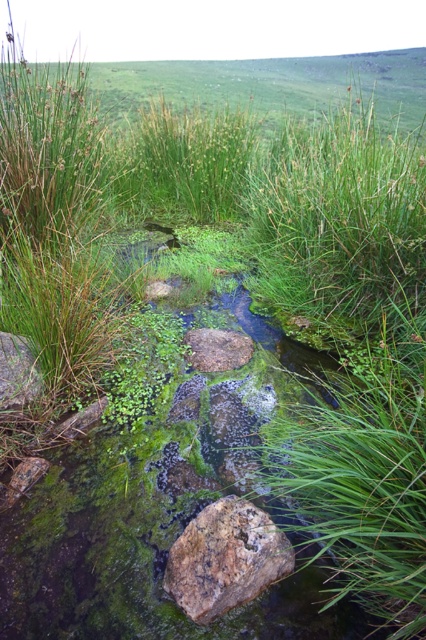
Is brown rough rock at center closer to the viewer compared to brown rough stone at center?

Yes, it is.

Can you confirm if brown rough rock at center is smaller than brown rough stone at center?

No.

This screenshot has height=640, width=426. I want to click on brown rough rock at center, so click(x=226, y=557).

Between brown rough rock at center and smooth gray rock at lower left, which one appears on the left side from the viewer's perspective?

From the viewer's perspective, smooth gray rock at lower left appears more on the left side.

Between brown rough rock at center and smooth gray rock at lower left, which one has less height?

Standing shorter between the two is brown rough rock at center.

Describe the element at coordinates (226, 557) in the screenshot. I see `brown rough rock at center` at that location.

You are a GUI agent. You are given a task and a screenshot of the screen. Output one action in this format:
    pyautogui.click(x=<x>, y=<y>)
    Task: Click on the brown rough rock at center
    
    Given the screenshot: What is the action you would take?
    pyautogui.click(x=226, y=557)

Between smooth gray rock at lower left and brown rough stone at center, which one has more height?

With more height is smooth gray rock at lower left.

The width and height of the screenshot is (426, 640). What do you see at coordinates (17, 372) in the screenshot?
I see `smooth gray rock at lower left` at bounding box center [17, 372].

The height and width of the screenshot is (640, 426). What do you see at coordinates (17, 372) in the screenshot?
I see `smooth gray rock at lower left` at bounding box center [17, 372].

Where is `smooth gray rock at lower left`? Image resolution: width=426 pixels, height=640 pixels. smooth gray rock at lower left is located at coordinates (17, 372).